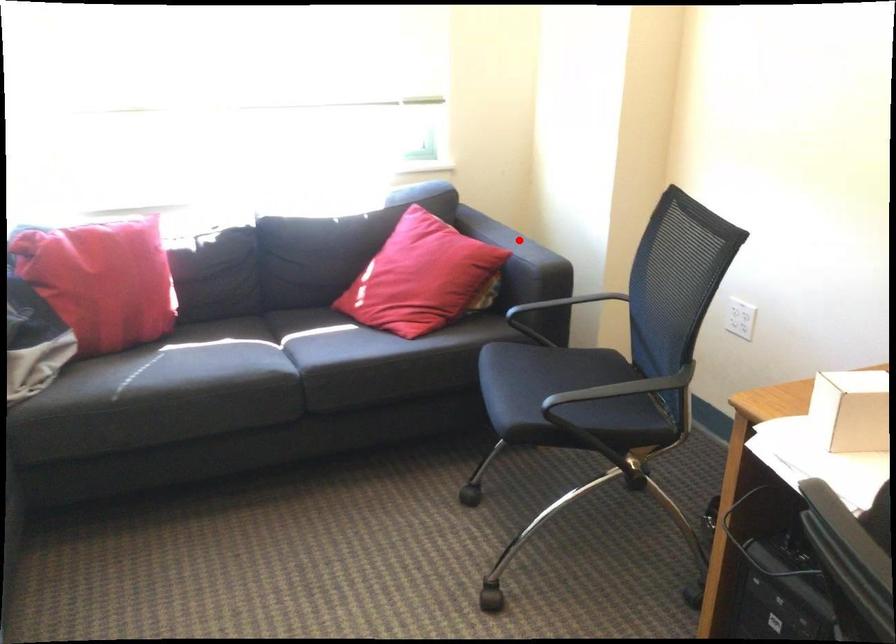
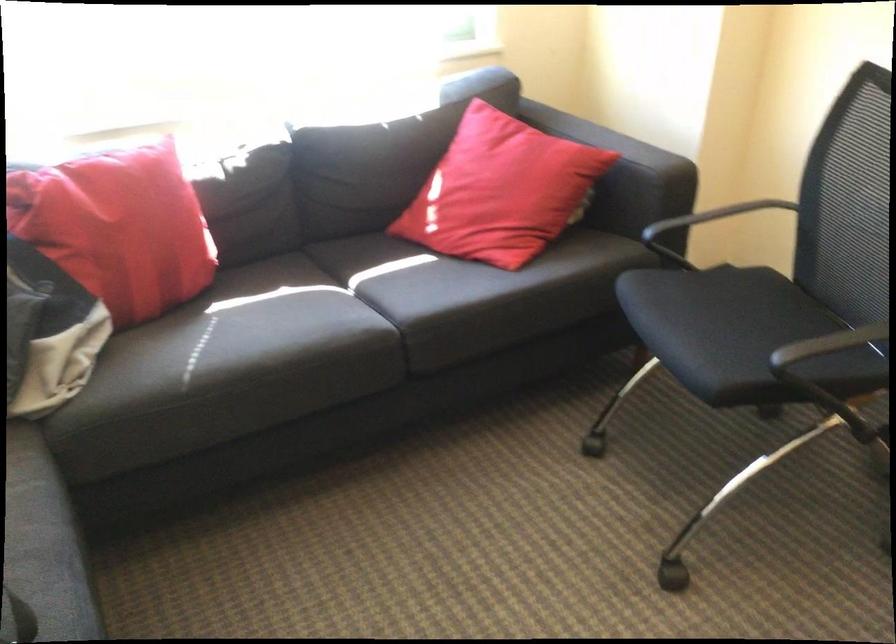
In the second image, find the point that corresponds to the highlighted location in the first image.

(616, 140)